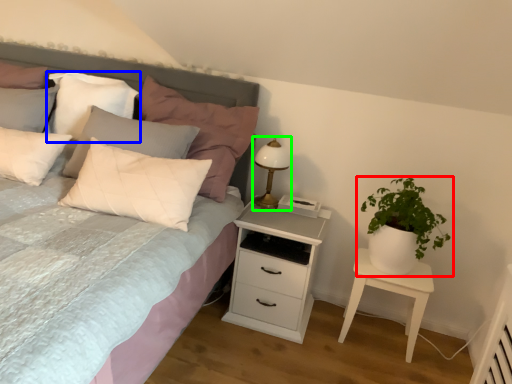
Question: Which object is positioned closest to houseplant (highlighted by a red box)? Select from pillow (highlighted by a blue box) and bedside lamp (highlighted by a green box).

Choices:
 (A) pillow
 (B) bedside lamp

Answer: (B)